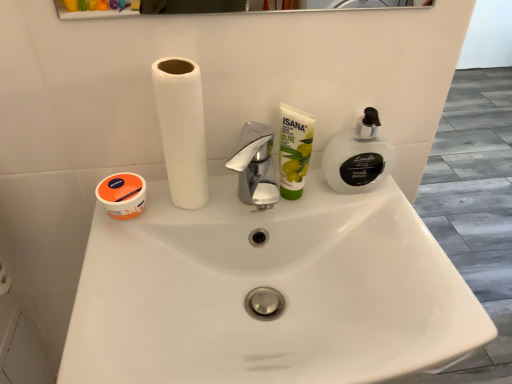
Where is `unoccupied area in front of orange matte cream at left`? The image size is (512, 384). unoccupied area in front of orange matte cream at left is located at coordinates (112, 283).